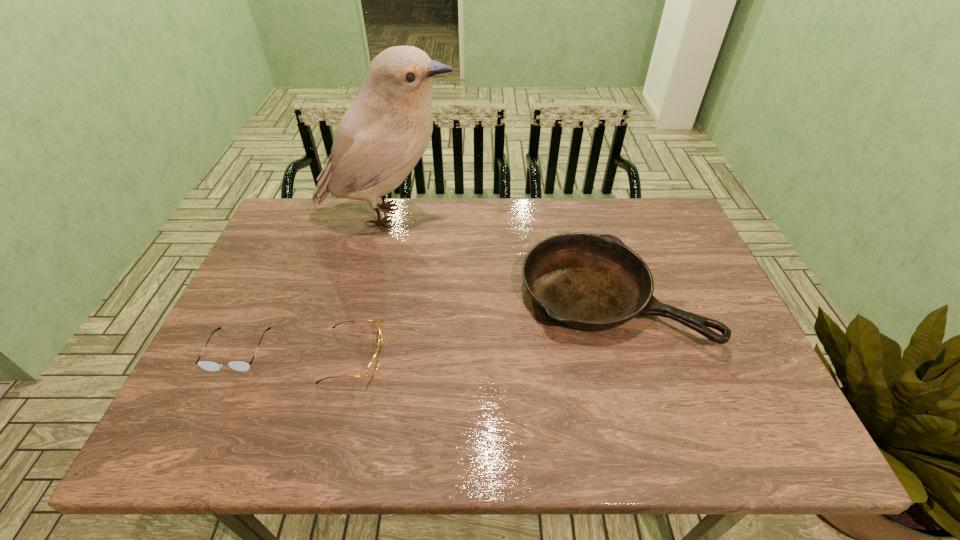
At what (x,y) coordinates should I click in order to perform the action: click on vacant region located on the lenses of the left spectacles. Please return your answer as a coordinate pair (x, y). This screenshot has width=960, height=540. Looking at the image, I should click on (199, 434).

Where is `object at the far edge`? object at the far edge is located at coordinates (386, 130).

The image size is (960, 540). Find the location of `parakeet that is at the left edge`. parakeet that is at the left edge is located at coordinates (386, 130).

At what (x,y) coordinates should I click in order to perform the action: click on spectacles present at the left edge. Please return your answer as a coordinate pair (x, y). The width and height of the screenshot is (960, 540). Looking at the image, I should click on (206, 365).

This screenshot has height=540, width=960. What are the coordinates of `object located in the right edge section of the desktop` in the screenshot? It's located at coord(593,282).

Identify the location of object at the far left corner. (386, 130).

Where is `vacant region at the far edge`? vacant region at the far edge is located at coordinates (419, 211).

In the image, there is a desktop. At what (x,y) coordinates should I click in order to perform the action: click on free space at the near edge. Please return your answer as a coordinate pair (x, y). Image resolution: width=960 pixels, height=540 pixels. Looking at the image, I should click on (264, 434).

Locate an element on the screen. The image size is (960, 540). vacant space at the left edge of the desktop is located at coordinates (227, 406).

Identify the location of vacant region at the right edge of the desktop. pos(712,315).